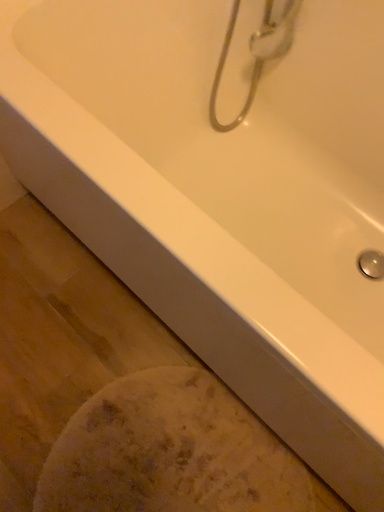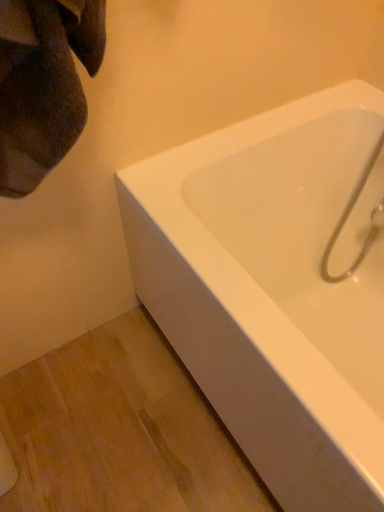
Question: Which way did the camera rotate in the video?

Choices:
 (A) rotated downward
 (B) rotated upward

Answer: (B)